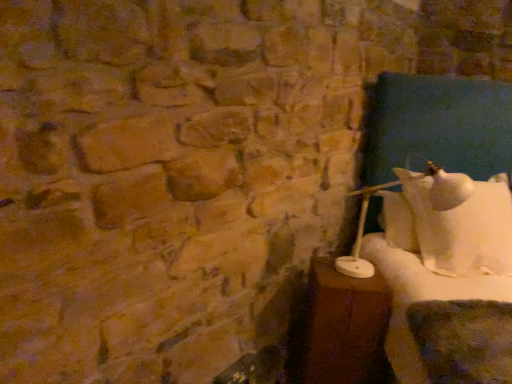
Find the location of a particular element. The image size is (512, 384). empty space that is ontop of brown wooden table at right (from a real-world perspective) is located at coordinates (346, 280).